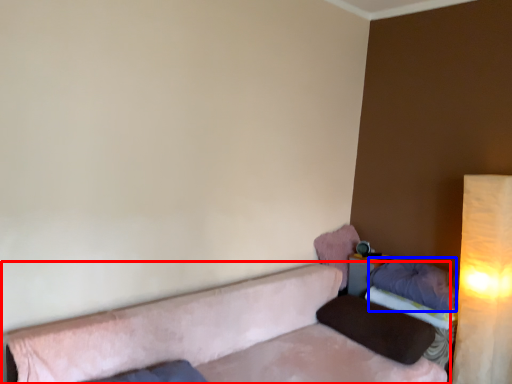
Question: Which point is further to the camera, studio couch (highlighted by a red box) or pillow (highlighted by a blue box)?

Choices:
 (A) studio couch
 (B) pillow

Answer: (B)